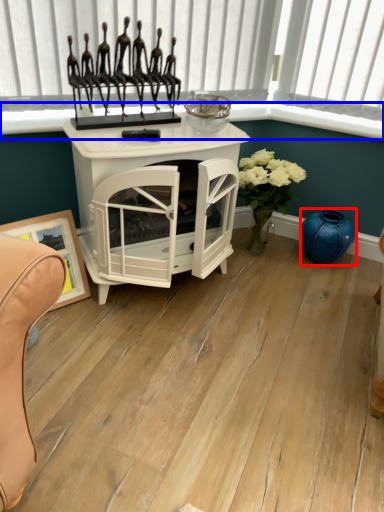
Question: Which object is closer to the camera taking this photo, vase (highlighted by a red box) or window sill (highlighted by a blue box)?

Choices:
 (A) vase
 (B) window sill

Answer: (B)